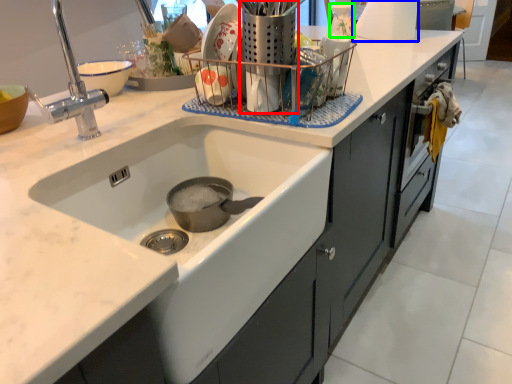
Question: Based on their relative distances, which object is nearer to appliance (highlighted by a red box)? Choose from appliance (highlighted by a blue box) and appliance (highlighted by a green box).

Choices:
 (A) appliance
 (B) appliance

Answer: (B)